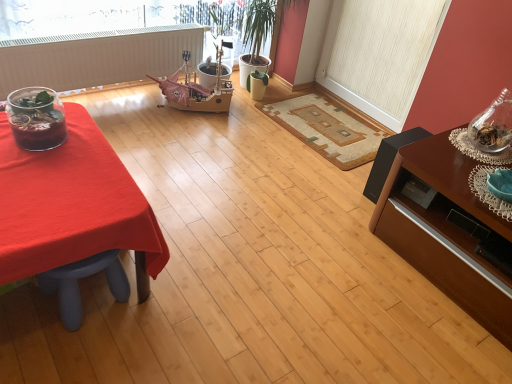
The width and height of the screenshot is (512, 384). In order to click on free spot below white matte radiator at upper left (from a real-world perspective) in this screenshot , I will do `click(116, 98)`.